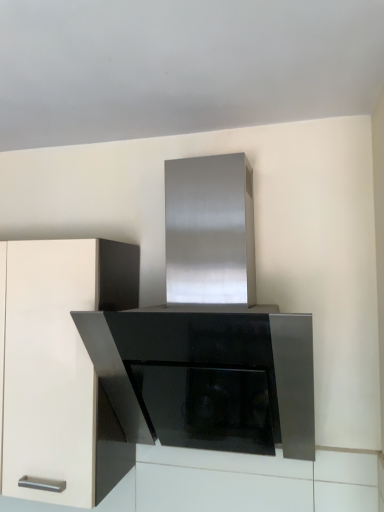
Question: From the image's perspective, is stainless steel range hood at center above matte white cabinet at left?

Choices:
 (A) no
 (B) yes

Answer: (B)

Question: Is stainless steel range hood at center far from matte white cabinet at left?

Choices:
 (A) yes
 (B) no

Answer: (B)

Question: Is stainless steel range hood at center bigger than matte white cabinet at left?

Choices:
 (A) no
 (B) yes

Answer: (B)

Question: Is stainless steel range hood at center at the left side of matte white cabinet at left?

Choices:
 (A) no
 (B) yes

Answer: (A)

Question: Considering the relative positions of stainless steel range hood at center and matte white cabinet at left in the image provided, is stainless steel range hood at center to the right of matte white cabinet at left from the viewer's perspective?

Choices:
 (A) yes
 (B) no

Answer: (A)

Question: Is stainless steel range hood at center taller than matte white cabinet at left?

Choices:
 (A) yes
 (B) no

Answer: (A)

Question: Is matte white cabinet at left further to the viewer compared to stainless steel range hood at center?

Choices:
 (A) yes
 (B) no

Answer: (A)

Question: Can you confirm if matte white cabinet at left is taller than stainless steel range hood at center?

Choices:
 (A) yes
 (B) no

Answer: (B)

Question: Is matte white cabinet at left placed right next to stainless steel range hood at center?

Choices:
 (A) yes
 (B) no

Answer: (B)

Question: Is matte white cabinet at left not inside stainless steel range hood at center?

Choices:
 (A) yes
 (B) no

Answer: (A)

Question: Considering the relative sizes of matte white cabinet at left and stainless steel range hood at center in the image provided, is matte white cabinet at left thinner than stainless steel range hood at center?

Choices:
 (A) yes
 (B) no

Answer: (A)

Question: Is stainless steel range hood at center surrounded by matte white cabinet at left?

Choices:
 (A) yes
 (B) no

Answer: (B)

Question: Does point (243, 330) appear closer or farther from the camera than point (54, 463)?

Choices:
 (A) farther
 (B) closer

Answer: (B)